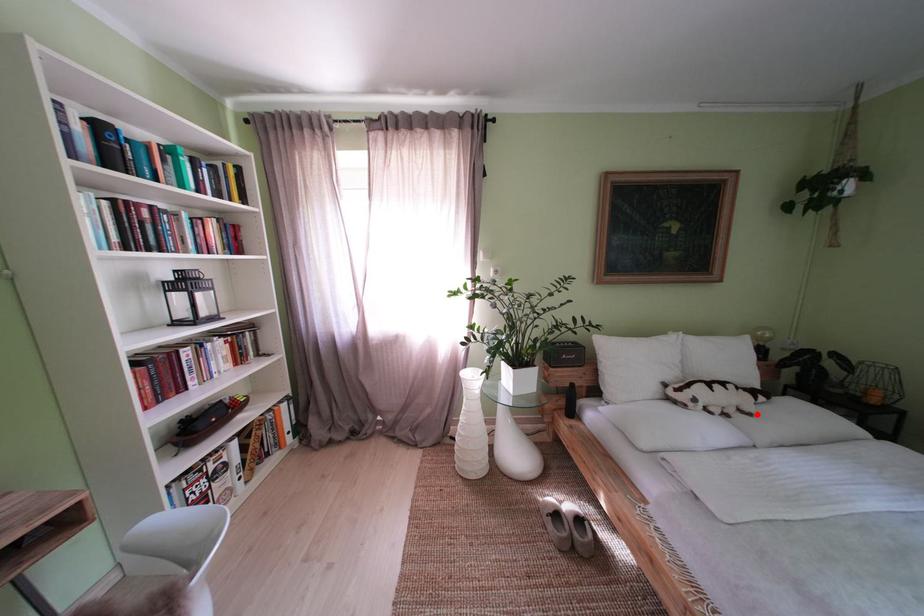
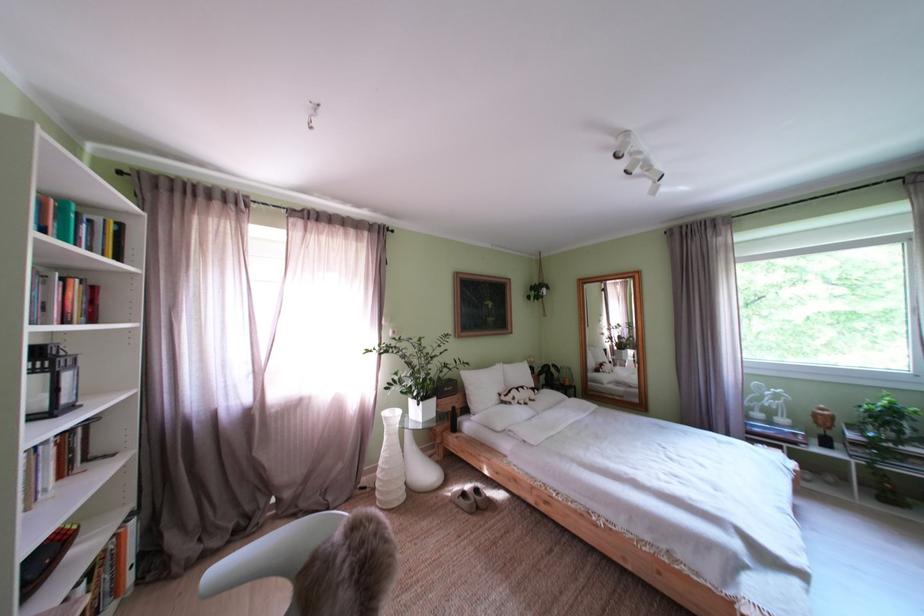
Question: I am providing you with two images of the same scene from different viewpoints. Given a red point in image1, look at the same physical point in image2. Is it:

Choices:
 (A) Closer to the viewpoint
 (B) Farther from the viewpoint

Answer: (B)